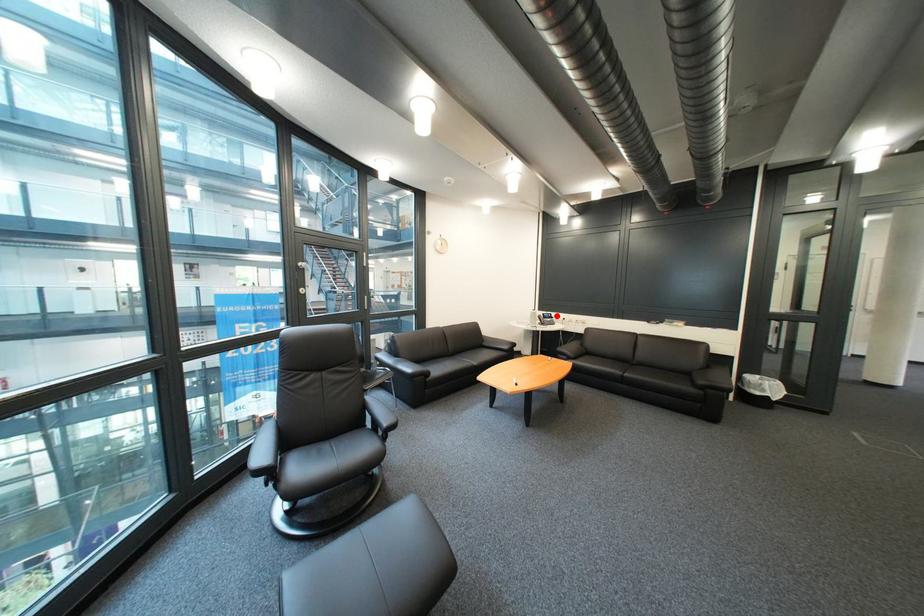
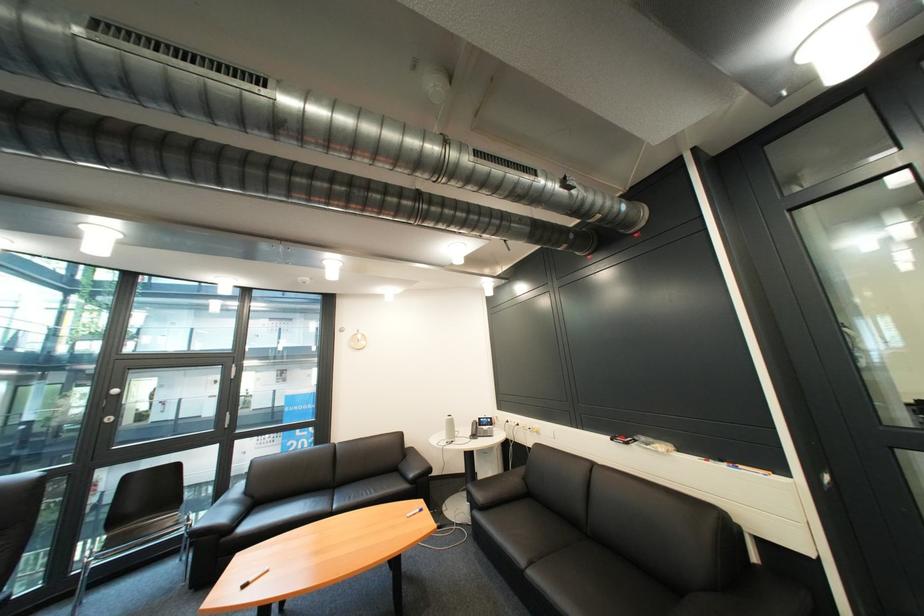
Where in the second image is the point corresponding to the highlighted location from the first image?

(492, 419)